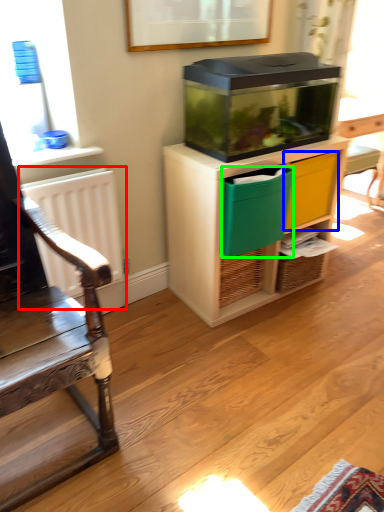
Question: Estimate the real-world distances between objects in this image. Which object is farther from radiator (highlighted by a red box), drawer (highlighted by a blue box) or crate (highlighted by a green box)?

Choices:
 (A) drawer
 (B) crate

Answer: (A)